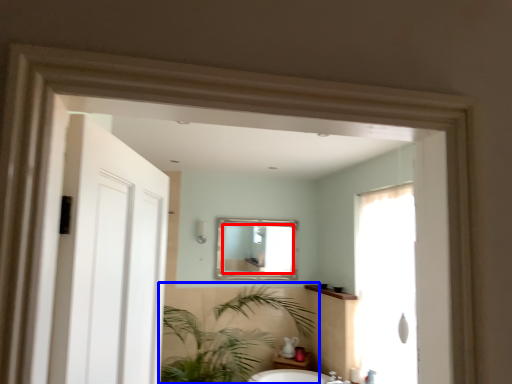
Question: Which point is closer to the camera, mirror (highlighted by a red box) or houseplant (highlighted by a blue box)?

Choices:
 (A) mirror
 (B) houseplant

Answer: (B)